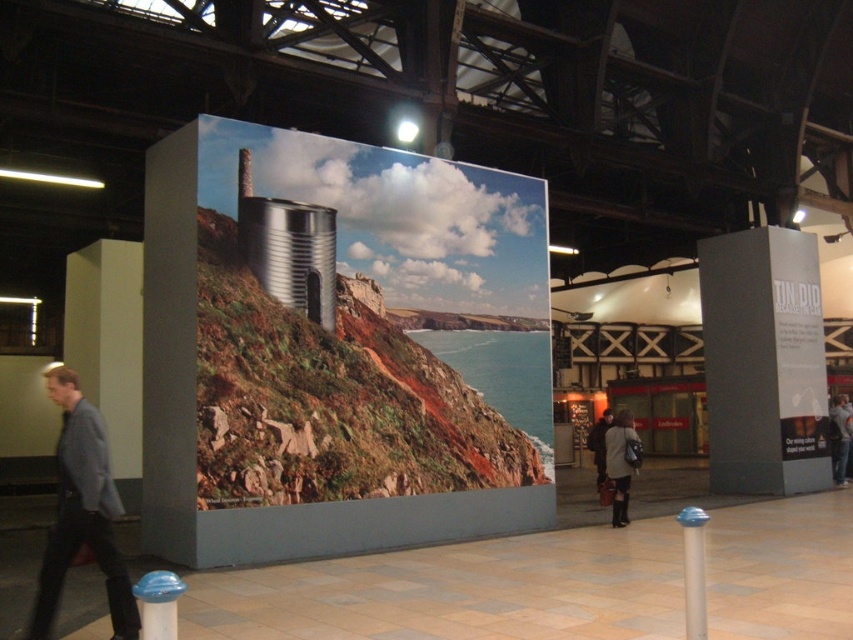
You are an event planner setting up a photo exhibition. You have a matte gray pillar at center and a dark brown leather jacket at lower right in the image. Which object would require more space horizontally if you were to move them both to the side of the room?

The dark brown leather jacket at lower right would require more space horizontally because it is wider than the matte gray pillar at center.

You are at an exhibition and see two items displayed at the center of the room. The dark gray coat at center and the gray fabric jacket at center. Which one is positioned to the left?

The dark gray coat at center is positioned to the left of the gray fabric jacket at center.

You are standing in the exhibition hall and want to determine the relative positions of two points marked on the display panel. Which of the two points, point 1 at coordinates point (78, 390) or point 2 at coordinates point (602, 433), is closer to you?

Point 1 at coordinates point (78, 390) is closer to the viewer than point 2 at coordinates point (602, 433).